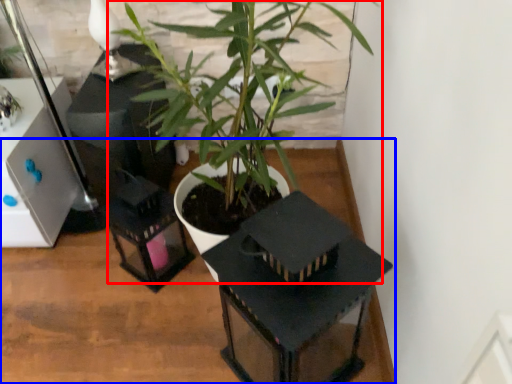
Question: Which object is closer to the camera taking this photo, houseplant (highlighted by a red box) or table (highlighted by a blue box)?

Choices:
 (A) houseplant
 (B) table

Answer: (A)